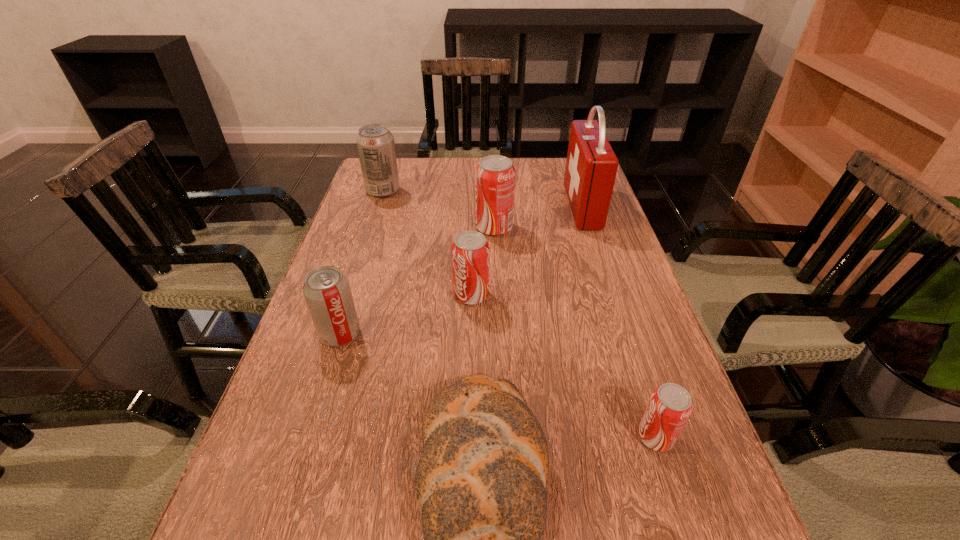
The height and width of the screenshot is (540, 960). In order to click on the smallest red soda can in this screenshot , I will do `click(670, 405)`.

The image size is (960, 540). In order to click on the shortest soda can in this screenshot , I will do `click(670, 405)`.

Where is `vacant space situated on the front face of the red first-aid kit`? The height and width of the screenshot is (540, 960). vacant space situated on the front face of the red first-aid kit is located at coordinates (511, 207).

Where is `vacant area located 0.330m on the front face of the red first-aid kit`? The width and height of the screenshot is (960, 540). vacant area located 0.330m on the front face of the red first-aid kit is located at coordinates (455, 207).

Locate an element on the screen. This screenshot has width=960, height=540. vacant space situated on the front face of the red first-aid kit is located at coordinates (442, 207).

At what (x,y) coordinates should I click in order to perform the action: click on free space located on the logo side of the biggest red soda can. Please return your answer as a coordinate pair (x, y). This screenshot has height=540, width=960. Looking at the image, I should click on (358, 228).

Identify the location of vacant space located 0.340m on the logo side of the biggest red soda can. Image resolution: width=960 pixels, height=540 pixels. (350, 228).

Identify the location of free region located 0.110m on the logo side of the biggest red soda can. (435, 228).

Locate an element on the screen. The width and height of the screenshot is (960, 540). free region located 0.120m on the back of the bigger gray soda can is located at coordinates (392, 165).

At what (x,y) coordinates should I click in order to perform the action: click on vacant space situated on the back of the second nearest soda can. Please return your answer as a coordinate pair (x, y). Looking at the image, I should click on (362, 266).